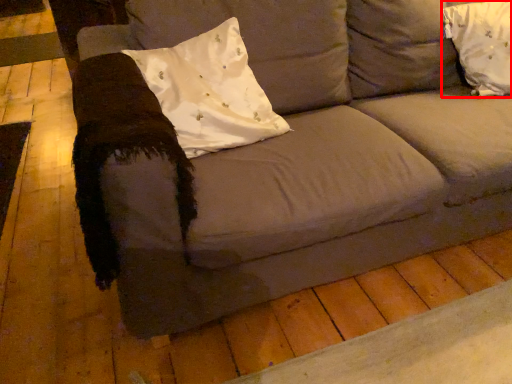
Question: From the image's perspective, what is the correct spatial relationship of pillow (annotated by the red box) in relation to pillow?

Choices:
 (A) above
 (B) below

Answer: (A)